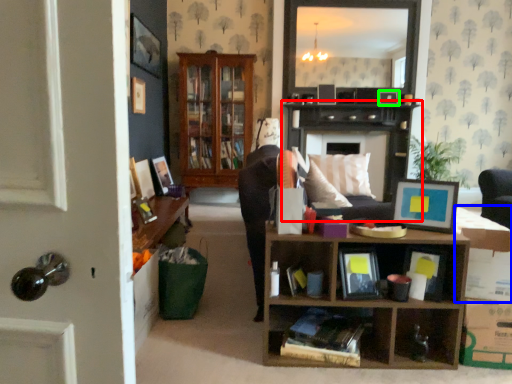
Question: Considering the real-world distances, which object is farthest from cabinet (highlighted by a red box)? cardboard box (highlighted by a blue box) or picture frame (highlighted by a green box)?

Choices:
 (A) cardboard box
 (B) picture frame

Answer: (A)